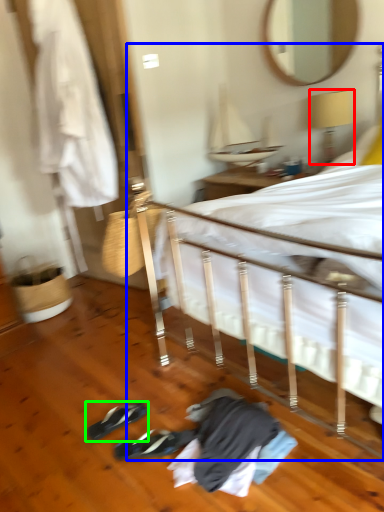
Question: Considering the real-world distances, which object is farthest from lamp (highlighted by a red box)? bed (highlighted by a blue box) or footwear (highlighted by a green box)?

Choices:
 (A) bed
 (B) footwear

Answer: (B)